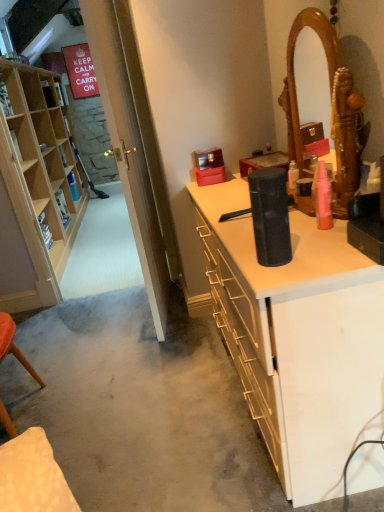
Where is `vacant area that lies in front of black matte speaker at center`? This screenshot has width=384, height=512. vacant area that lies in front of black matte speaker at center is located at coordinates (286, 275).